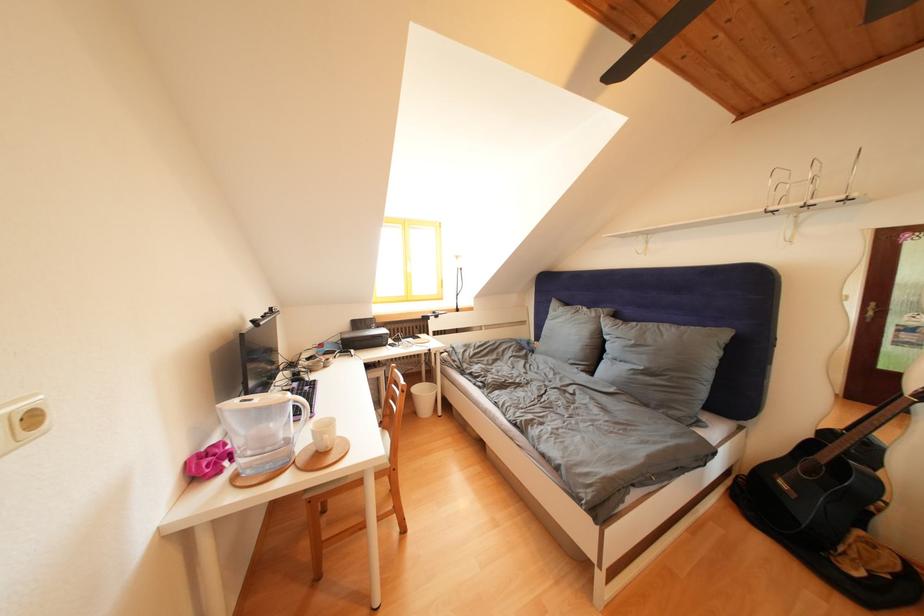
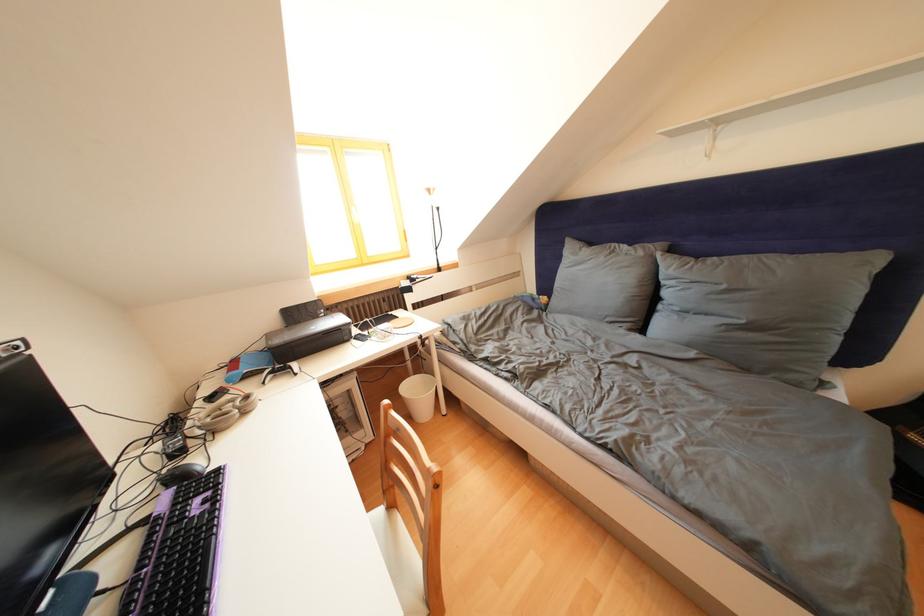
In the second image, find the point that corresponds to point (378, 333) in the first image.

(323, 322)